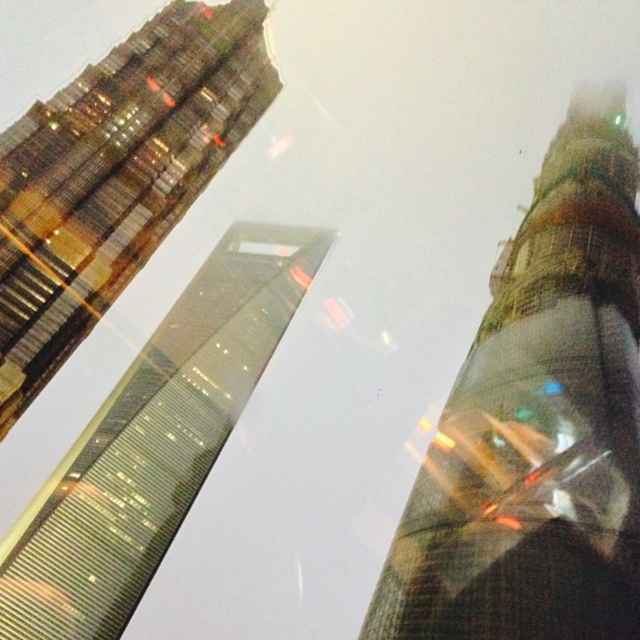
Question: Is translucent glass tower at center to the right of glassy reflective skyscraper at upper left from the viewer's perspective?

Choices:
 (A) yes
 (B) no

Answer: (A)

Question: Which point is closer to the camera taking this photo?

Choices:
 (A) (492, 356)
 (B) (241, 301)
 (C) (186, 115)

Answer: (C)

Question: Considering the real-world distances, which object is closest to the glassy reflective skyscraper at upper left?

Choices:
 (A) translucent glass tower at center
 (B) reflective glass skyscraper at center

Answer: (A)

Question: From the image, what is the correct spatial relationship of glassy reflective skyscraper at upper left in relation to reflective glass skyscraper at center?

Choices:
 (A) below
 (B) above

Answer: (B)

Question: Does translucent glass tower at center appear under reflective glass skyscraper at center?

Choices:
 (A) yes
 (B) no

Answer: (B)

Question: Which object is the farthest from the reflective glass skyscraper at center?

Choices:
 (A) translucent glass tower at center
 (B) glassy reflective skyscraper at upper left

Answer: (B)